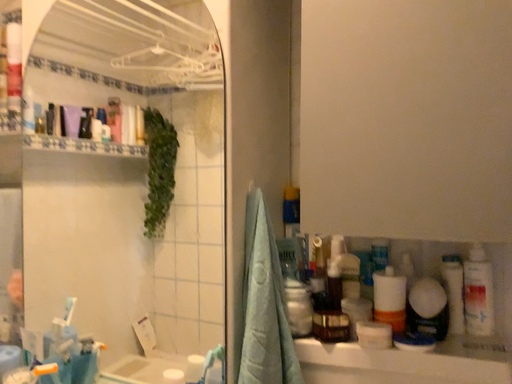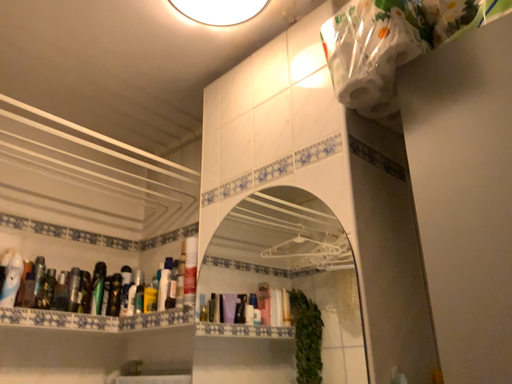
Question: How did the camera likely rotate when shooting the video?

Choices:
 (A) rotated downward
 (B) rotated upward

Answer: (B)